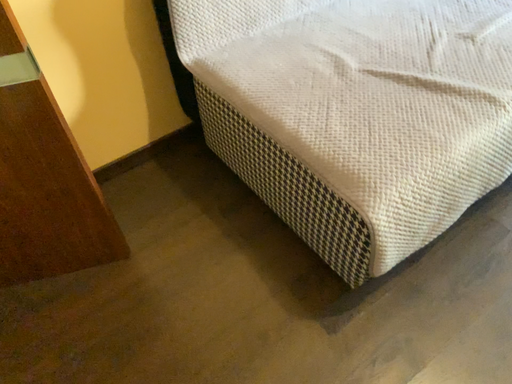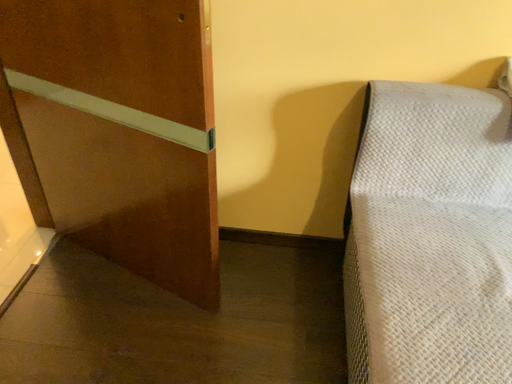
Question: How did the camera likely rotate when shooting the video?

Choices:
 (A) rotated upward
 (B) rotated downward

Answer: (A)